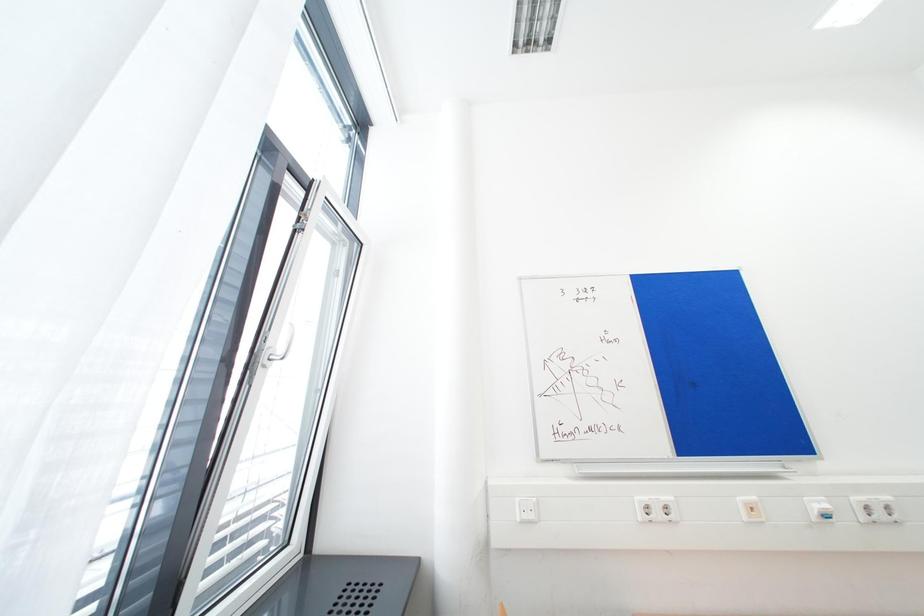
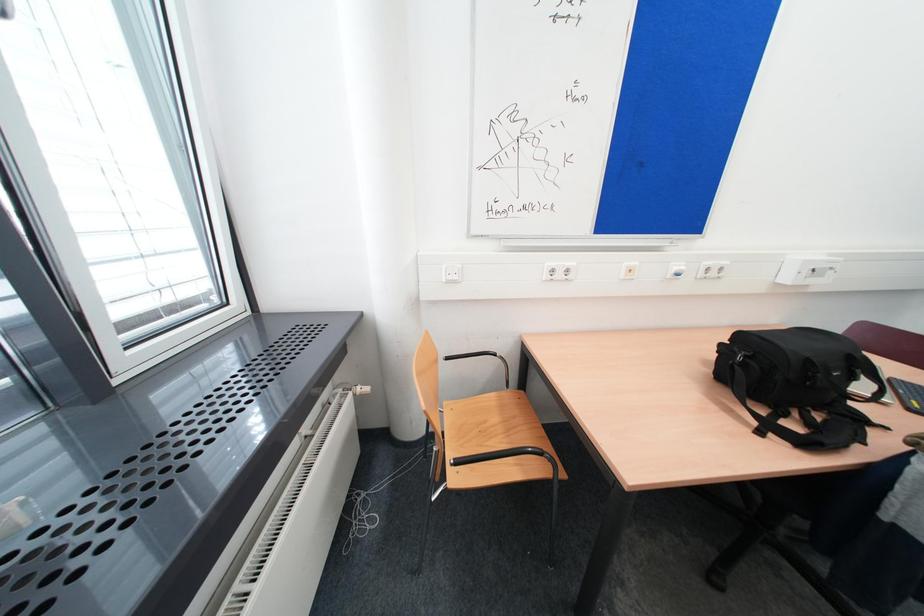
Question: Based on the continuous images, in which direction is the camera rotating? Reply with the corresponding letter.

Choices:
 (A) Left
 (B) Right
 (C) Up
 (D) Down

Answer: (D)